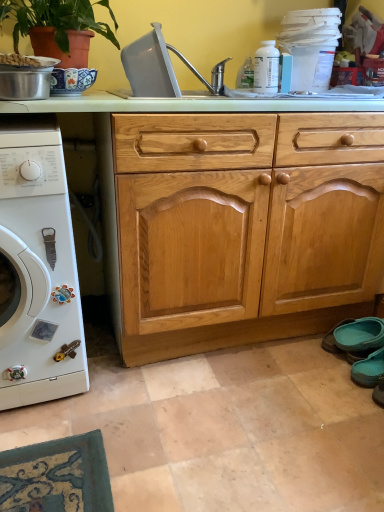
Question: From the image's perspective, is gray plastic sink at upper center located above white matte washing machine at left?

Choices:
 (A) yes
 (B) no

Answer: (A)

Question: Considering the relative sizes of gray plastic sink at upper center and white matte washing machine at left in the image provided, is gray plastic sink at upper center bigger than white matte washing machine at left?

Choices:
 (A) no
 (B) yes

Answer: (A)

Question: Is gray plastic sink at upper center positioned in front of white matte washing machine at left?

Choices:
 (A) no
 (B) yes

Answer: (A)

Question: Is white matte washing machine at left a part of gray plastic sink at upper center?

Choices:
 (A) no
 (B) yes

Answer: (A)

Question: Does gray plastic sink at upper center have a lesser height compared to white matte washing machine at left?

Choices:
 (A) yes
 (B) no

Answer: (A)

Question: Is the depth of gray plastic sink at upper center greater than that of white matte washing machine at left?

Choices:
 (A) yes
 (B) no

Answer: (A)

Question: Considering the relative sizes of gray plastic sink at upper center and metallic silver pot at upper left in the image provided, is gray plastic sink at upper center thinner than metallic silver pot at upper left?

Choices:
 (A) no
 (B) yes

Answer: (A)

Question: Does gray plastic sink at upper center contain metallic silver pot at upper left?

Choices:
 (A) no
 (B) yes

Answer: (A)

Question: Does gray plastic sink at upper center appear on the right side of metallic silver pot at upper left?

Choices:
 (A) yes
 (B) no

Answer: (A)

Question: From the image's perspective, is gray plastic sink at upper center located above metallic silver pot at upper left?

Choices:
 (A) yes
 (B) no

Answer: (A)

Question: From a real-world perspective, is gray plastic sink at upper center physically above metallic silver pot at upper left?

Choices:
 (A) yes
 (B) no

Answer: (A)

Question: Can you confirm if gray plastic sink at upper center is shorter than metallic silver pot at upper left?

Choices:
 (A) yes
 (B) no

Answer: (B)

Question: From the image's perspective, is white matte washing machine at left under metallic silver pot at upper left?

Choices:
 (A) yes
 (B) no

Answer: (A)